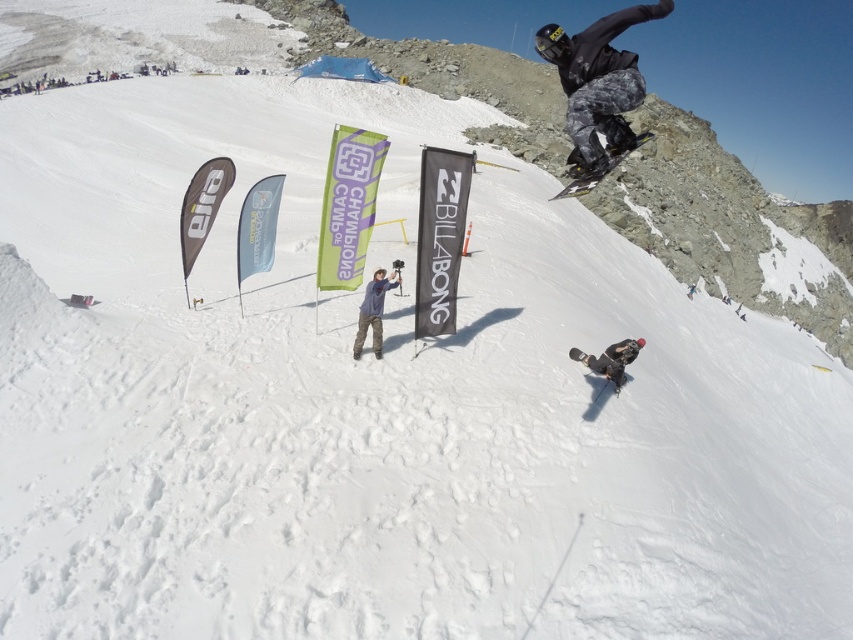
Which is more to the right, dark gray snowboarder at lower right or black matte snowboard at lower center?

dark gray snowboarder at lower right

Is dark gray snowboarder at lower right thinner than black matte snowboard at lower center?

In fact, dark gray snowboarder at lower right might be wider than black matte snowboard at lower center.

Identify the location of dark gray snowboarder at lower right. The image size is (853, 640). (614, 358).

Locate an element on the screen. dark gray snowboarder at lower right is located at coordinates (614, 358).

How much distance is there between denim pants at center and shiny black snowboard at upper right?

denim pants at center is 6.51 meters from shiny black snowboard at upper right.

Is denim pants at center bigger than shiny black snowboard at upper right?

No, denim pants at center is not bigger than shiny black snowboard at upper right.

Between point (375, 336) and point (599, 179), which one is positioned in front?

Point (599, 179) is in front.

Identify the location of denim pants at center. The width and height of the screenshot is (853, 640). (373, 310).

Looking at this image, is camouflage pants at upper right further to the viewer compared to shiny black snowboard at upper right?

No, it is in front of shiny black snowboard at upper right.

Is point (599, 80) positioned after point (608, 163)?

No, (599, 80) is closer to viewer.

Does point (577, 170) come closer to viewer compared to point (641, 145)?

Yes, it is.

This screenshot has height=640, width=853. Identify the location of camouflage pants at upper right. (598, 83).